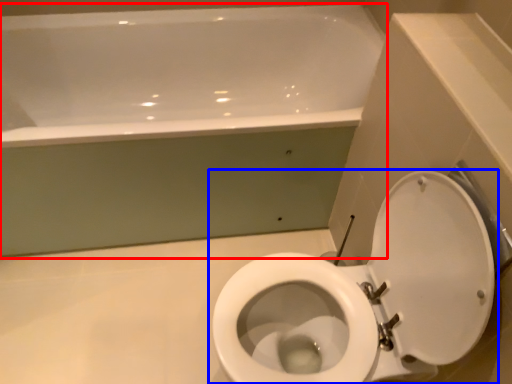
Question: Which of the following is the closest to the observer, bathtub (highlighted by a red box) or toilet (highlighted by a blue box)?

Choices:
 (A) bathtub
 (B) toilet

Answer: (B)